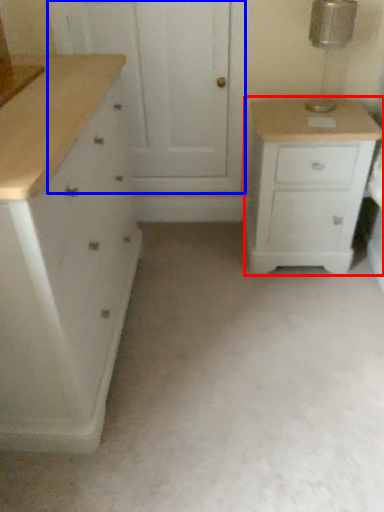
Question: Which point is further to the camera, chest of drawers (highlighted by a red box) or screen door (highlighted by a blue box)?

Choices:
 (A) chest of drawers
 (B) screen door

Answer: (B)